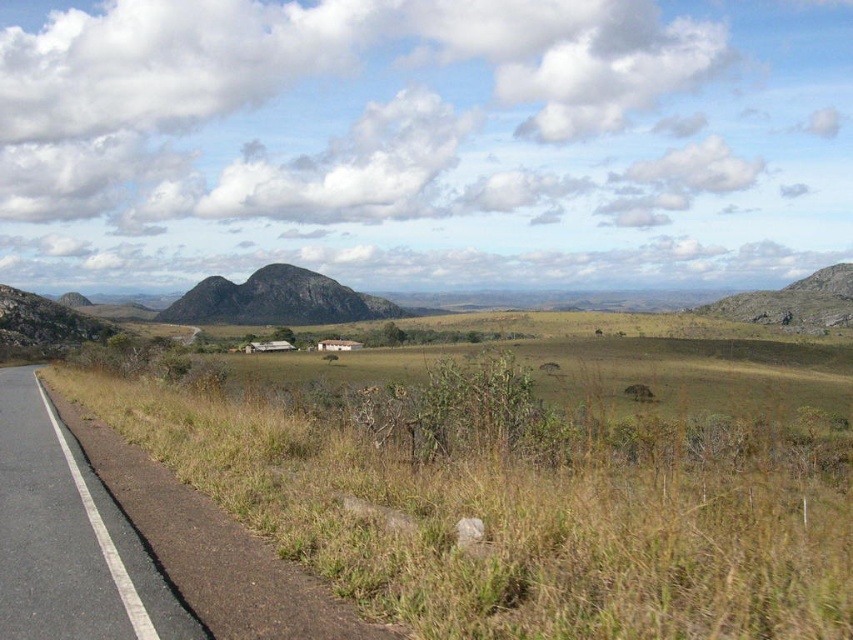
You are a hiker trying to navigate from the brown grassland at lower left to the dark gray rock formation at center. Which direction should you head to reach your destination?

The brown grassland at lower left is positioned on the right side of the dark gray rock formation at center, so to reach the rock formation, you should head to the left.

You are driving a car with a width of 2 meters. You need to cross either the brown grassland at lower left or the black asphalt road at left. Which path is wider and can accommodate your car?

The brown grassland at lower left is wider than the black asphalt road at left, so it can accommodate your car with a width of 2 meters.